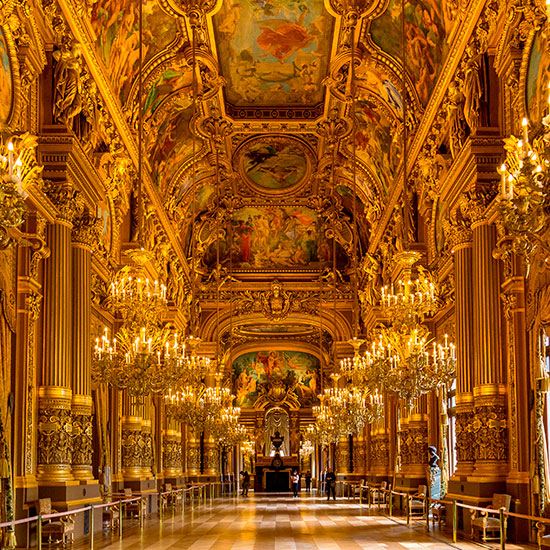
I want to click on murals, so click(x=270, y=364), click(x=274, y=241), click(x=270, y=173), click(x=177, y=140), click(x=370, y=125), click(x=266, y=88).